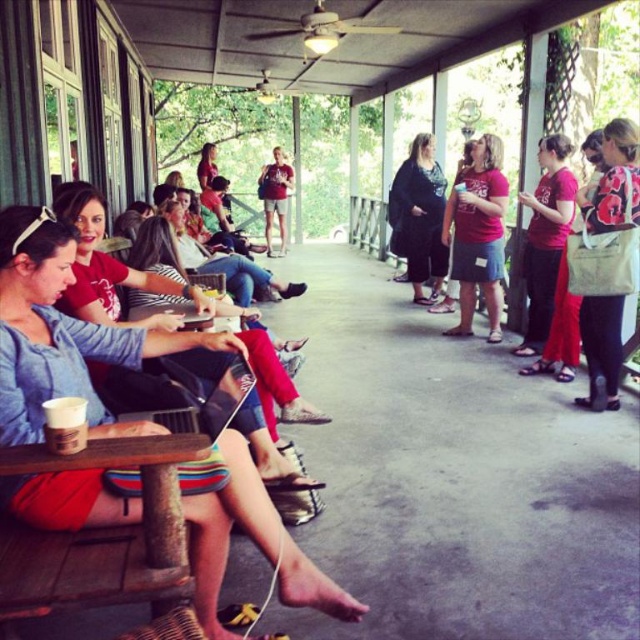
You are standing at the point labeled point (472, 262) and want to reach the entrance to the porch. The entrance is located at the opposite end of the porch. If you walk directly toward the entrance, will you pass through the area where the group is sitting?

The distance between you and the entrance is 5.70 meters. The group is sitting on the left side of the porch. Since the entrance is at the opposite end, walking directly toward it would take you away from the group, so you would not pass through their area.

You are a photographer taking a picture of the matte blue shirt at left and the printed cotton shirt at center. Which shirt should you focus on first if you want to capture both in the same frame without moving the camera?

You should focus on the printed cotton shirt at center first because the matte blue shirt at left is below it, so adjusting focus to the upper position ensures both are in frame.